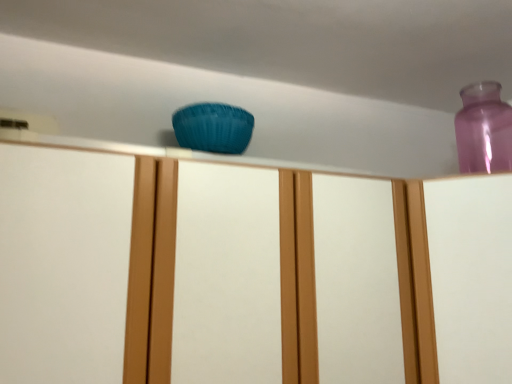
Describe the element at coordinates (248, 273) in the screenshot. I see `matte blue bowl at center` at that location.

Measure the distance between point (186, 299) and camera.

The depth of point (186, 299) is 31.10 inches.

At what (x,y) coordinates should I click in order to perform the action: click on matte blue bowl at center. Please return your answer as a coordinate pair (x, y). Looking at the image, I should click on (248, 273).

Identify the location of matte blue bowl at center. (248, 273).